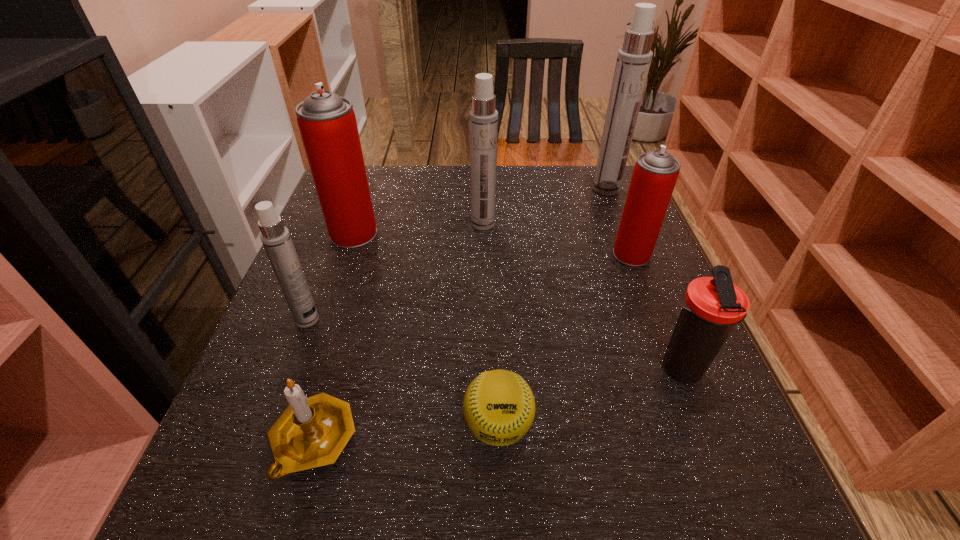
Locate an element on the screen. unoccupied position between the yellow softball and the tallest aerosol can is located at coordinates (552, 307).

What are the coordinates of `free space between the second biggest white aerosol can and the gold candle holder` in the screenshot? It's located at (398, 332).

The image size is (960, 540). What are the coordinates of `vacant point located between the yellow softball and the bigger red aerosol can` in the screenshot? It's located at (426, 329).

I want to click on object that is the third closest to the biggest white aerosol can, so click(711, 306).

Choose which object is the third nearest neighbor to the seventh tallest object. Please provide its 2D coordinates. Your answer should be formatted as a tuple, i.e. [(x, y)], where the tuple contains the x and y coordinates of a point satisfying the conditions above.

[(327, 123)]

Locate which aerosol can ranks fourth in proximity to the leftmost white aerosol can. Please provide its 2D coordinates. Your answer should be formatted as a tuple, i.e. [(x, y)], where the tuple contains the x and y coordinates of a point satisfying the conditions above.

[(633, 62)]

Identify which aerosol can is the third nearest to the fifth farthest object. Please provide its 2D coordinates. Your answer should be formatted as a tuple, i.e. [(x, y)], where the tuple contains the x and y coordinates of a point satisfying the conditions above.

[(655, 173)]

Identify which white aerosol can is the second closest to the tallest object. Please provide its 2D coordinates. Your answer should be formatted as a tuple, i.e. [(x, y)], where the tuple contains the x and y coordinates of a point satisfying the conditions above.

[(275, 237)]

This screenshot has width=960, height=540. Find the location of `white aerosol can that stands as the closest to the second white aerosol can from right to left`. white aerosol can that stands as the closest to the second white aerosol can from right to left is located at coordinates (633, 62).